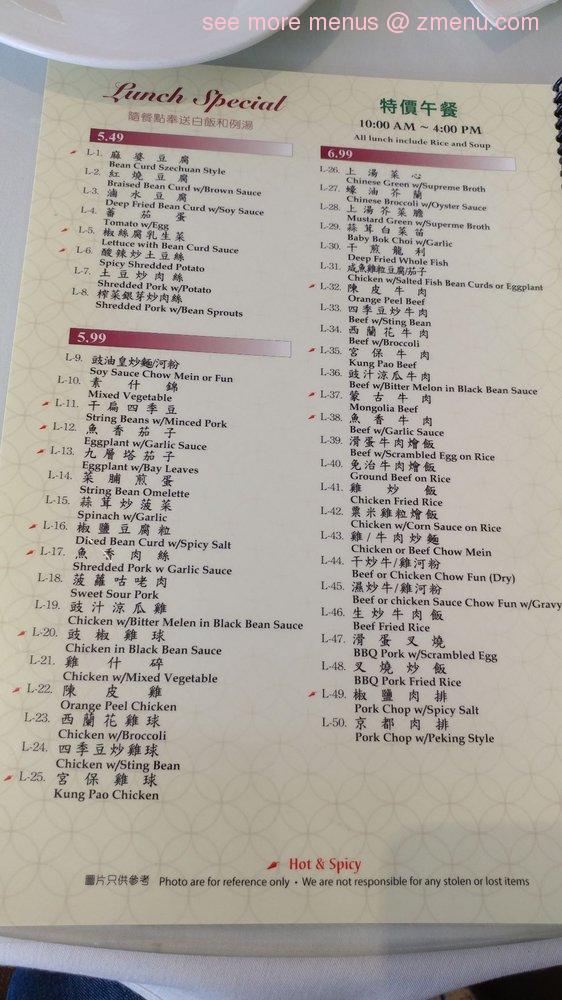
The image size is (562, 1000). Identify the location of floor. (465, 997).